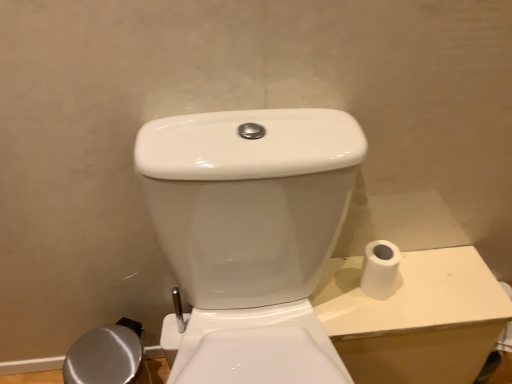
Find the location of a particular element. This screenshot has height=384, width=512. vacant area that is in front of white matte toilet paper at right is located at coordinates (379, 307).